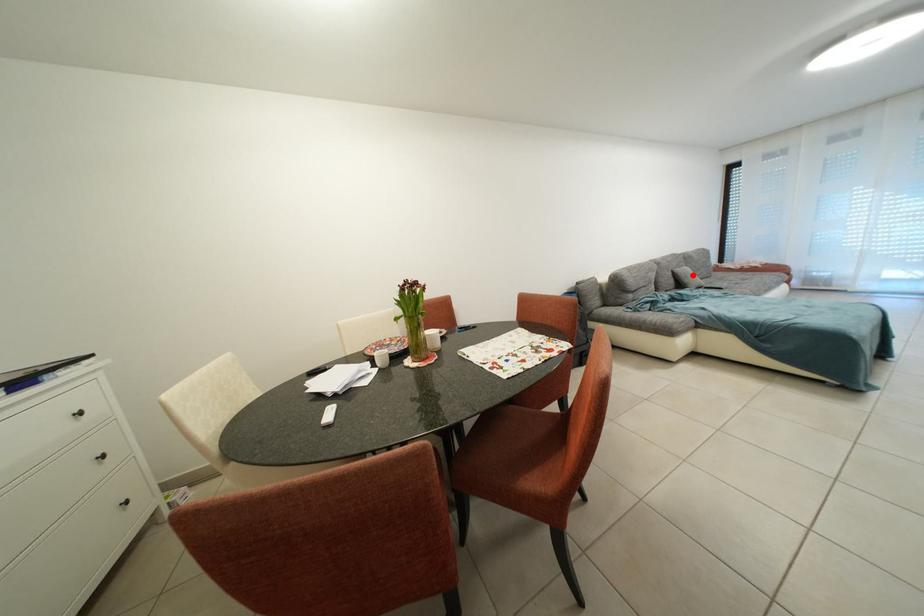
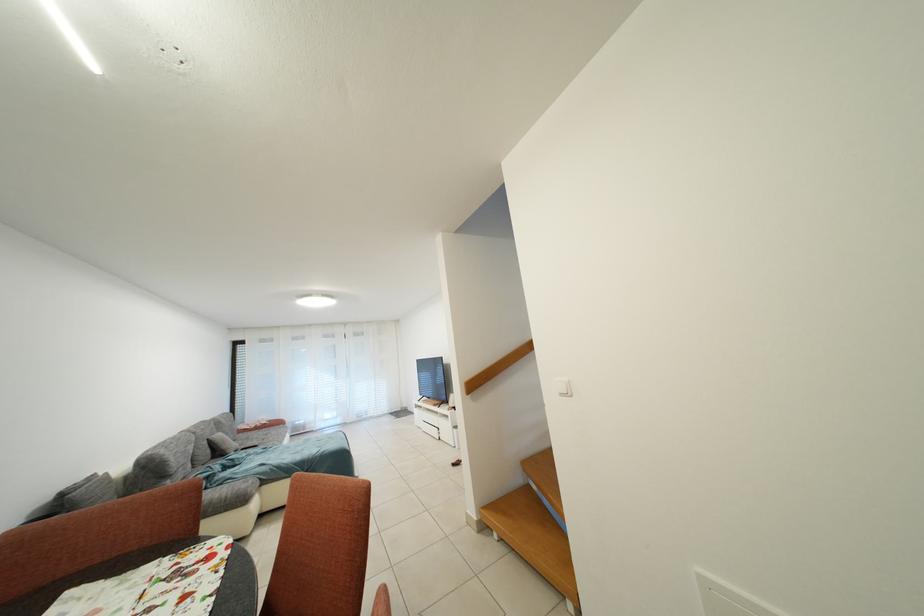
Question: I am providing you with two images of the same scene from different viewpoints. Given a red point in image1, look at the same physical point in image2. Is it:

Choices:
 (A) Closer to the viewpoint
 (B) Farther from the viewpoint

Answer: (A)